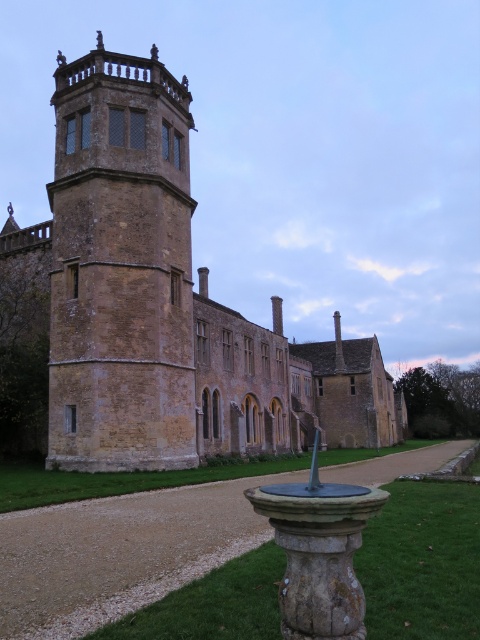
You are a visitor standing in front of the historic building. You want to take a photo of the brown stone tower at upper left without the brown stone castle at center blocking the view. Is this possible?

The brown stone tower at upper left is behind the brown stone castle at center, so it will be blocked by the castle. You cannot take a photo of the tower without the castle blocking the view.

You are standing in front of the grand historic building and notice a specific point marked at coordinates (166,301). Based on the scene description, what object or feature does this coordinate point to?

The point at coordinates (166,301) corresponds to the brown stone castle at center.